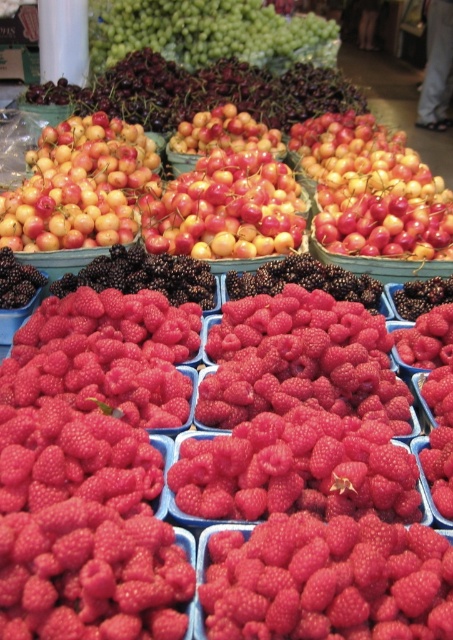
What are the coordinates of the shiny black berries at center in the image?

The coordinates of the shiny black berries at center are at point [144,275].

You are a vendor arranging fruits at the market stall. You have a green matte grapes at upper center and a shiny black berries at center. Which of these two has a greater width?

The green matte grapes at upper center has a greater width than the shiny black berries at center.